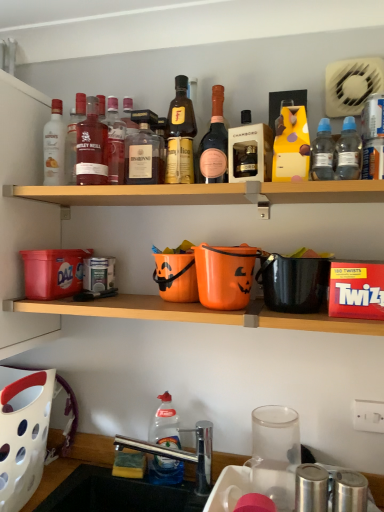
What do you see at coordinates (165, 424) in the screenshot? I see `clear plastic bottle at sink, the sixth bottle positioned from the right` at bounding box center [165, 424].

Describe the element at coordinates (373, 137) in the screenshot. The width and height of the screenshot is (384, 512). I see `white plastic can at upper right, which is the 1th bottle from right to left` at that location.

Image resolution: width=384 pixels, height=512 pixels. What do you see at coordinates (143, 151) in the screenshot? I see `matte glass bottle at center, the 5th bottle positioned from the left` at bounding box center [143, 151].

How much space does matte glass bottle at center, which ranks as the 7th bottle in right-to-left order, occupy vertically?

matte glass bottle at center, which ranks as the 7th bottle in right-to-left order, is 23.92 centimeters in height.

The image size is (384, 512). Describe the element at coordinates (322, 153) in the screenshot. I see `clear plastic bottle at upper right, positioned as the 9th bottle in left-to-right order` at that location.

Image resolution: width=384 pixels, height=512 pixels. Identify the location of chrome metallic sink at lower center. (174, 448).

From a real-world perspective, starting from the pink glass bottle at upper center, the fourth bottle positioned from the right, which bottle is the 2nd one below it? Please provide its 2D coordinates.

[(92, 147)]

Which of these two, matte glass bottle at upper left, the third bottle when ordered from left to right, or pink glass bottle at upper center, the fourth bottle positioned from the right, is wider?

Wider between the two is matte glass bottle at upper left, the third bottle when ordered from left to right.

Does matte glass bottle at upper left, which is the ninth bottle in right-to-left order, touch pink glass bottle at upper center, the fourth bottle positioned from the right?

No, matte glass bottle at upper left, which is the ninth bottle in right-to-left order, is not in contact with pink glass bottle at upper center, the fourth bottle positioned from the right.

Considering the relative sizes of matte glass bottle at upper left, the third bottle when ordered from left to right, and pink glass bottle at upper center, placed as the 8th bottle when sorted from left to right, in the image provided, is matte glass bottle at upper left, the third bottle when ordered from left to right, bigger than pink glass bottle at upper center, placed as the 8th bottle when sorted from left to right,?

Yes, matte glass bottle at upper left, the third bottle when ordered from left to right, is bigger than pink glass bottle at upper center, placed as the 8th bottle when sorted from left to right.

From a real-world perspective, who is located lower, gold metallic liquor at center, the 7th bottle positioned from the left, or matte glass bottle at upper left, the 2th bottle from the left?

matte glass bottle at upper left, the 2th bottle from the left, is physically lower.

From the image's perspective, relative to matte glass bottle at upper left, which ranks as the tenth bottle in right-to-left order, is gold metallic liquor at center, placed as the 5th bottle when sorted from right to left, above or below?

gold metallic liquor at center, placed as the 5th bottle when sorted from right to left, is situated higher than matte glass bottle at upper left, which ranks as the tenth bottle in right-to-left order, in the image.

Are gold metallic liquor at center, the 7th bottle positioned from the left, and matte glass bottle at upper left, which ranks as the tenth bottle in right-to-left order, beside each other?

They are not placed beside each other.

Considering the relative sizes of white plastic basket at lower left and gold metallic liquor at center, placed as the 5th bottle when sorted from right to left, in the image provided, is white plastic basket at lower left bigger than gold metallic liquor at center, placed as the 5th bottle when sorted from right to left,?

Correct, white plastic basket at lower left is larger in size than gold metallic liquor at center, placed as the 5th bottle when sorted from right to left.

Considering the sizes of white plastic basket at lower left and gold metallic liquor at center, the 7th bottle positioned from the left, in the image, is white plastic basket at lower left wider or thinner than gold metallic liquor at center, the 7th bottle positioned from the left,?

white plastic basket at lower left is wider than gold metallic liquor at center, the 7th bottle positioned from the left.

Between white plastic basket at lower left and gold metallic liquor at center, placed as the 5th bottle when sorted from right to left, which one is positioned behind?

Positioned behind is gold metallic liquor at center, placed as the 5th bottle when sorted from right to left.

From a real-world perspective, is white plastic basket at lower left positioned over gold metallic liquor at center, placed as the 5th bottle when sorted from right to left, based on gravity?

No, from a real-world perspective, white plastic basket at lower left is not above gold metallic liquor at center, placed as the 5th bottle when sorted from right to left.

Is clear plastic bottle at sink, the sixth bottle positioned from the right, wider or thinner than white plastic can at upper right, which is the 1th bottle from right to left?

Clearly, clear plastic bottle at sink, the sixth bottle positioned from the right, has more width compared to white plastic can at upper right, which is the 1th bottle from right to left.

From a real-world perspective, is clear plastic bottle at sink, which appears as the sixth bottle when viewed from the left, physically located above or below white plastic can at upper right, which is the 1th bottle from right to left?

clear plastic bottle at sink, which appears as the sixth bottle when viewed from the left, is situated lower than white plastic can at upper right, which is the 1th bottle from right to left, in the real world.

From the image's perspective, is clear plastic bottle at sink, which appears as the sixth bottle when viewed from the left, above or below white plastic can at upper right, which is the 1th bottle from right to left?

clear plastic bottle at sink, which appears as the sixth bottle when viewed from the left, is below white plastic can at upper right, which is the 1th bottle from right to left.

Does white plastic basket at lower left contain matte glass bottle at center, the 5th bottle positioned from the left?

No, matte glass bottle at center, the 5th bottle positioned from the left, is not surrounded by white plastic basket at lower left.

Considering the sizes of objects white plastic basket at lower left and matte glass bottle at center, the 5th bottle positioned from the left, in the image provided, who is shorter, white plastic basket at lower left or matte glass bottle at center, the 5th bottle positioned from the left,?

matte glass bottle at center, the 5th bottle positioned from the left.

Is white plastic basket at lower left behind matte glass bottle at center, the 5th bottle positioned from the left?

No, it is not.

From the image's perspective, relative to matte glass bottle at center, which ranks as the 7th bottle in right-to-left order, is white plastic basket at lower left above or below?

white plastic basket at lower left is situated lower than matte glass bottle at center, which ranks as the 7th bottle in right-to-left order, in the image.

Does pink glass bottle at upper center, placed as the 8th bottle when sorted from left to right, lie in front of wooden shelf at upper center?

No, the depth of pink glass bottle at upper center, placed as the 8th bottle when sorted from left to right, is greater than that of wooden shelf at upper center.

From a real-world perspective, which is physically above, pink glass bottle at upper center, the fourth bottle positioned from the right, or wooden shelf at upper center?

pink glass bottle at upper center, the fourth bottle positioned from the right, is physically above.

Between pink glass bottle at upper center, placed as the 8th bottle when sorted from left to right, and wooden shelf at upper center, which one has more height?

With more height is pink glass bottle at upper center, placed as the 8th bottle when sorted from left to right.

Do you think white plastic basket at lower left is within clear plastic bottle at upper right, positioned as the 9th bottle in left-to-right order, or outside of it?

white plastic basket at lower left is spatially situated outside clear plastic bottle at upper right, positioned as the 9th bottle in left-to-right order.

Find the location of a particular element. The image size is (384, 512). basket that is under the clear plastic bottle at upper right, positioned as the 9th bottle in left-to-right order (from a real-world perspective) is located at coordinates (23, 432).

From the image's perspective, is white plastic basket at lower left located beneath clear plastic bottle at upper right, arranged as the third bottle when viewed from the right?

Indeed, from the image's perspective, white plastic basket at lower left is shown beneath clear plastic bottle at upper right, arranged as the third bottle when viewed from the right.

From a real-world perspective, which bottle is the 2nd one above the matte glass bottle at upper left, the third bottle when ordered from left to right? Please provide its 2D coordinates.

[(214, 144)]

Locate an element on the screen. the 1st bottle behind the gold metallic liquor at center, placed as the 5th bottle when sorted from right to left, counting from the anchor's position is located at coordinates (73, 137).

Considering their positions, is white plastic can at upper right, which is the 1th bottle from right to left, positioned further to matte white bottle at upper left, the eleventh bottle positioned from the right, than matte red glass bottles at upper center, which is the fourth bottle in left-to-right order?

white plastic can at upper right, which is the 1th bottle from right to left, is positioned further to the anchor matte white bottle at upper left, the eleventh bottle positioned from the right.

When comparing their distances from matte glass bottle at upper left, which ranks as the tenth bottle in right-to-left order, does pink glass bottle at upper center, the fourth bottle positioned from the right, or clear plastic bottle at sink, the sixth bottle positioned from the right, seem closer?

pink glass bottle at upper center, the fourth bottle positioned from the right, lies closer to matte glass bottle at upper left, which ranks as the tenth bottle in right-to-left order, than the other object.

Considering their positions, is matte red glass bottles at upper center, which is counted as the eighth bottle, starting from the right, positioned closer to white plastic can at upper right, acting as the eleventh bottle starting from the left, than matte glass bottle at upper left, which is the ninth bottle in right-to-left order?

Among the two, matte red glass bottles at upper center, which is counted as the eighth bottle, starting from the right, is located nearer to white plastic can at upper right, acting as the eleventh bottle starting from the left.

Based on their spatial positions, is white plastic basket at lower left or matte glass bottle at upper left, which ranks as the tenth bottle in right-to-left order, closer to wooden shelf at upper center?

The object closer to wooden shelf at upper center is matte glass bottle at upper left, which ranks as the tenth bottle in right-to-left order.

From the picture: When comparing their distances from white plastic basket at lower left, does pink glass bottle at upper center, placed as the 8th bottle when sorted from left to right, or clear plastic bottle at upper right, the tenth bottle positioned from the left, seem further?

clear plastic bottle at upper right, the tenth bottle positioned from the left.

Looking at the image, which one is located further to wooden shelf at upper center, white plastic basket at lower left or matte white bottle at upper left, the eleventh bottle positioned from the right?

white plastic basket at lower left is positioned further to the anchor wooden shelf at upper center.

Considering their positions, is matte red glass bottles at upper center, which is counted as the eighth bottle, starting from the right, positioned closer to matte glass bottle at upper left, the 2th bottle from the left, than pink glass bottle at upper center, the fourth bottle positioned from the right?

The object closer to matte glass bottle at upper left, the 2th bottle from the left, is matte red glass bottles at upper center, which is counted as the eighth bottle, starting from the right.

From the image, which object appears to be nearer to chrome metallic sink at lower center, gold metallic liquor at center, the 7th bottle positioned from the left, or matte red glass bottles at upper center, which is counted as the eighth bottle, starting from the right?

Based on the image, gold metallic liquor at center, the 7th bottle positioned from the left, appears to be nearer to chrome metallic sink at lower center.

Where is `shelf between gold metallic liquor at center, placed as the 5th bottle when sorted from right to left, and white plastic can at upper right, which is the 1th bottle from right to left, in the horizontal direction`? shelf between gold metallic liquor at center, placed as the 5th bottle when sorted from right to left, and white plastic can at upper right, which is the 1th bottle from right to left, in the horizontal direction is located at coordinates (205, 193).

Find the location of a particular element. This screenshot has height=512, width=384. shelf between matte glass bottle at upper left, the 2th bottle from the left, and white plastic can at upper right, acting as the eleventh bottle starting from the left, from left to right is located at coordinates (205, 193).

The image size is (384, 512). In order to click on shelf located between matte red glass bottles at upper center, which is counted as the eighth bottle, starting from the right, and clear plastic bottle at upper right, positioned as the 9th bottle in left-to-right order, in the left-right direction in this screenshot , I will do `click(205, 193)`.

Where is `shelf located between matte glass bottle at center, which ranks as the 7th bottle in right-to-left order, and white plastic can at upper right, acting as the eleventh bottle starting from the left, in the left-right direction`? shelf located between matte glass bottle at center, which ranks as the 7th bottle in right-to-left order, and white plastic can at upper right, acting as the eleventh bottle starting from the left, in the left-right direction is located at coordinates (205, 193).